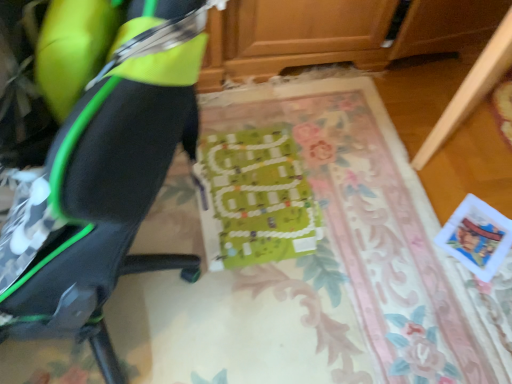
Question: Is green fabric board at center positioned behind wooden drawer at lower right?

Choices:
 (A) yes
 (B) no

Answer: (A)

Question: Is green fabric board at center located outside wooden drawer at lower right?

Choices:
 (A) yes
 (B) no

Answer: (A)

Question: From the image's perspective, is green fabric board at center located above wooden drawer at lower right?

Choices:
 (A) yes
 (B) no

Answer: (B)

Question: Can you confirm if green fabric board at center is taller than wooden drawer at lower right?

Choices:
 (A) no
 (B) yes

Answer: (A)

Question: Is green fabric board at center looking in the opposite direction of wooden drawer at lower right?

Choices:
 (A) yes
 (B) no

Answer: (B)

Question: Is matte black chair at left in front of or behind wooden drawer at lower right in the image?

Choices:
 (A) front
 (B) behind

Answer: (A)

Question: In the image, is matte black chair at left on the left side or the right side of wooden drawer at lower right?

Choices:
 (A) left
 (B) right

Answer: (A)

Question: Does point (105, 352) appear closer or farther from the camera than point (470, 112)?

Choices:
 (A) closer
 (B) farther

Answer: (A)

Question: Is matte black chair at left wider or thinner than wooden drawer at lower right?

Choices:
 (A) wide
 (B) thin

Answer: (A)

Question: Considering the positions of point (129, 48) and point (316, 107), is point (129, 48) closer or farther from the camera than point (316, 107)?

Choices:
 (A) closer
 (B) farther

Answer: (A)

Question: From the image's perspective, is matte black chair at left located above or below green fabric board at center?

Choices:
 (A) below
 (B) above

Answer: (B)

Question: Do you think matte black chair at left is within green fabric board at center, or outside of it?

Choices:
 (A) outside
 (B) inside

Answer: (A)

Question: Considering the positions of matte black chair at left and green fabric board at center in the image, is matte black chair at left bigger or smaller than green fabric board at center?

Choices:
 (A) small
 (B) big

Answer: (B)

Question: Considering the positions of green fabric board at center and matte black chair at left in the image, is green fabric board at center bigger or smaller than matte black chair at left?

Choices:
 (A) big
 (B) small

Answer: (B)

Question: From the image's perspective, is green fabric board at center above or below matte black chair at left?

Choices:
 (A) above
 (B) below

Answer: (B)